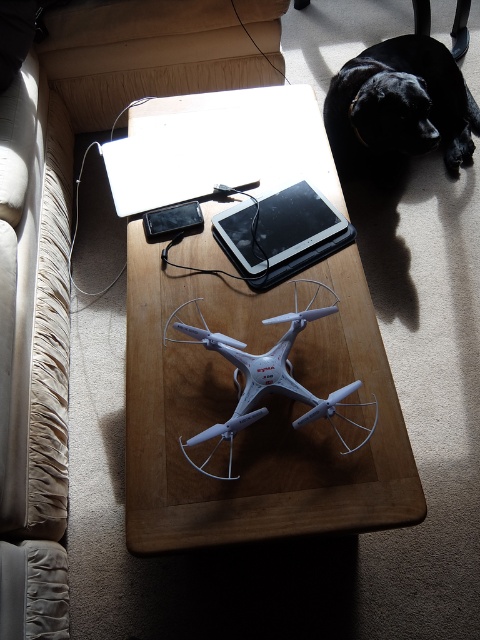
Question: Which of the following is the farthest from the observer?

Choices:
 (A) black matte tablet at center
 (B) white matte drone at center

Answer: (A)

Question: Is black matte tablet at center bigger than black matte tablet at upper center?

Choices:
 (A) no
 (B) yes

Answer: (B)

Question: Which object is farther from the camera taking this photo?

Choices:
 (A) white matte drone at center
 (B) black matte tablet at upper center

Answer: (B)

Question: Is beige fabric couch at left smaller than black matte tablet at upper center?

Choices:
 (A) yes
 (B) no

Answer: (B)

Question: Is wooden table at center to the left of white matte drone at center from the viewer's perspective?

Choices:
 (A) no
 (B) yes

Answer: (B)

Question: Based on their relative distances, which object is nearer to the black matte tablet at upper center?

Choices:
 (A) white matte drone at center
 (B) beige fabric couch at left
 (C) wooden table at center

Answer: (C)